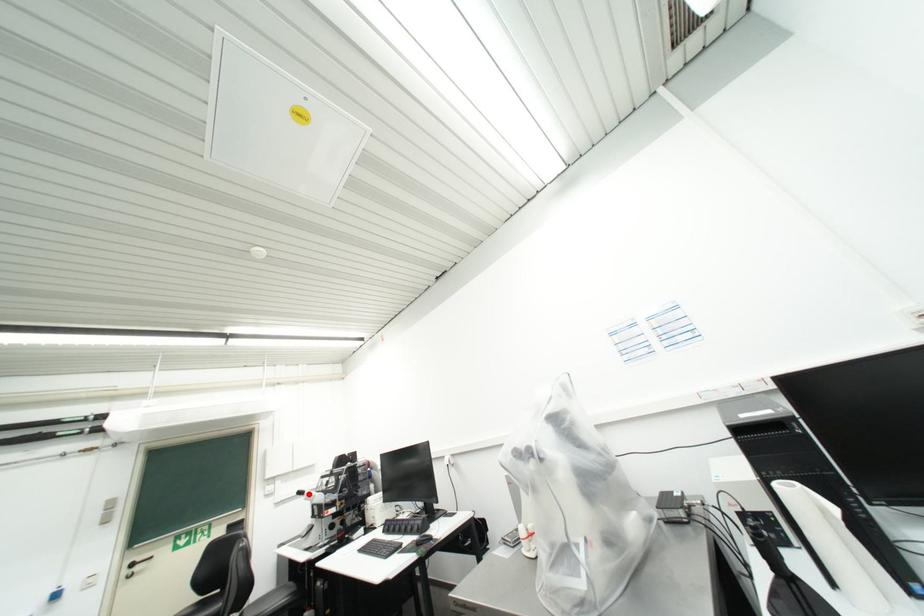
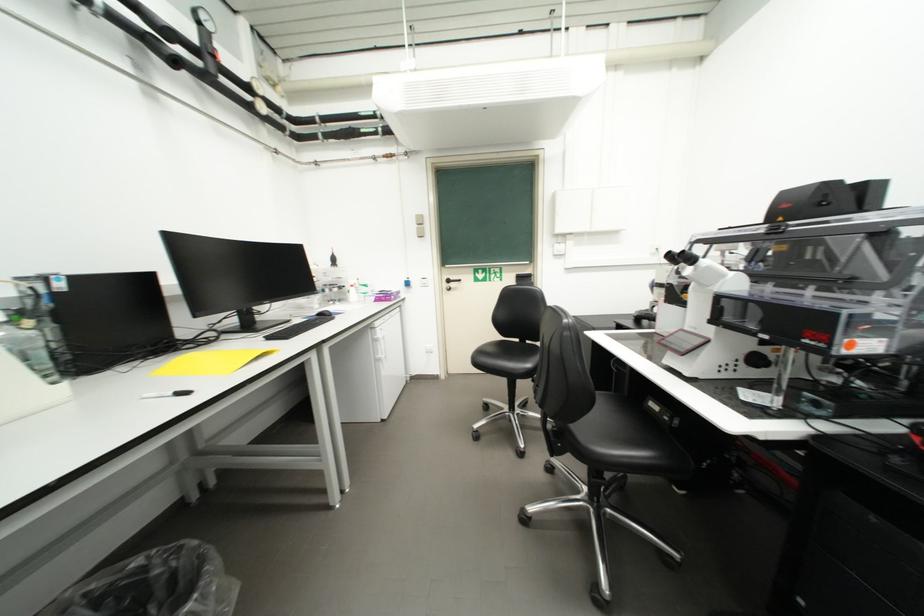
Locate, in the second image, the point that corresponds to the highlighted location in the first image.

(687, 259)